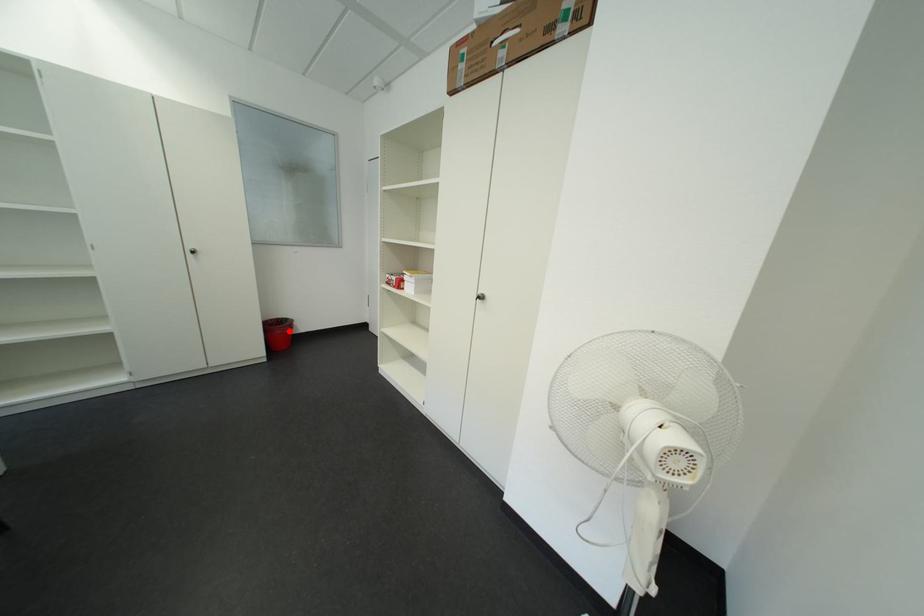
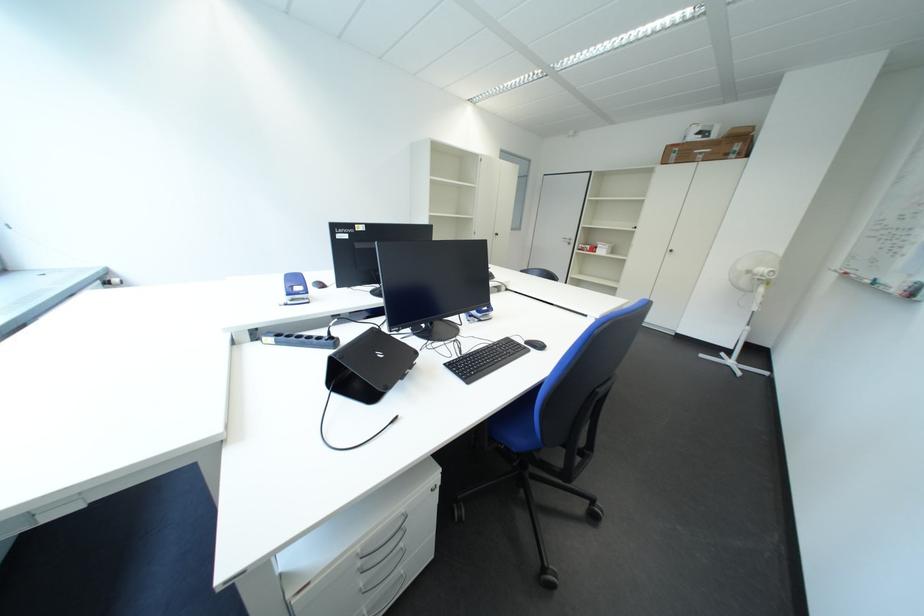
Question: I am providing you with two images of the same scene from different viewpoints. A red point is marked on the first image. Can you still see the location of the red point in image 2?

Choices:
 (A) Yes
 (B) No

Answer: (B)